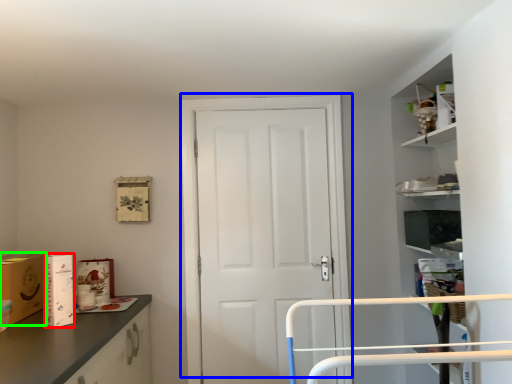
Question: Which object is the closest to the cardboard box (highlighted by a red box)? Choose among these: door (highlighted by a blue box) or cardboard box (highlighted by a green box).

Choices:
 (A) door
 (B) cardboard box

Answer: (B)